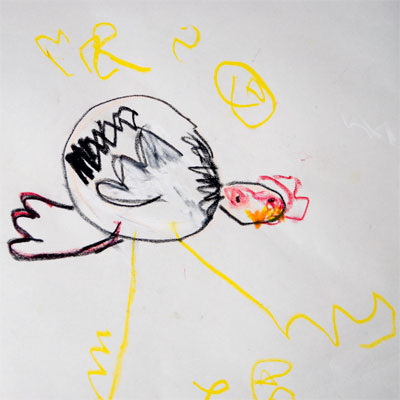
Where is `black markers`? The height and width of the screenshot is (400, 400). black markers is located at coordinates (193, 209).